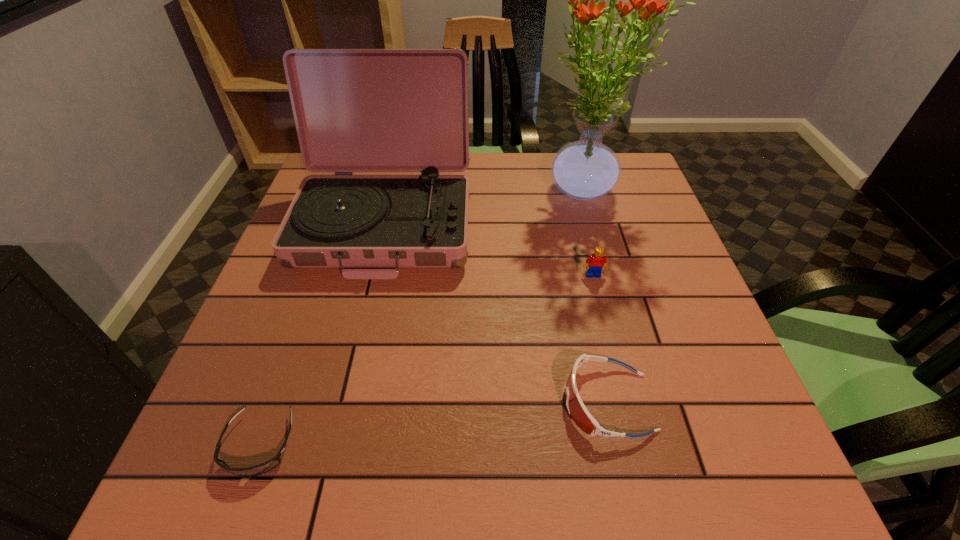
I want to click on object that is at the near left corner, so click(x=262, y=468).

Image resolution: width=960 pixels, height=540 pixels. Identify the location of object that is at the far right corner. (584, 170).

Where is `object that is positioned at the near right corner`? The image size is (960, 540). object that is positioned at the near right corner is located at coordinates (576, 408).

In the image, there is a desktop. Where is `blank space at the far edge`? This screenshot has height=540, width=960. blank space at the far edge is located at coordinates (468, 167).

This screenshot has width=960, height=540. I want to click on vacant region at the near edge of the desktop, so click(603, 457).

At what (x,y) coordinates should I click in order to perform the action: click on free space at the right edge of the desktop. Please return your answer as a coordinate pair (x, y). Looking at the image, I should click on (741, 407).

In the image, there is a desktop. Where is `free space at the far left corner`? free space at the far left corner is located at coordinates (322, 172).

Image resolution: width=960 pixels, height=540 pixels. In order to click on vacant space at the near left corner of the desktop in this screenshot , I will do `click(242, 443)`.

Identify the location of vacant space in between the tallest object and the taller goggles. (595, 296).

Locate an element on the screen. free space between the taller goggles and the third tallest object is located at coordinates (600, 339).